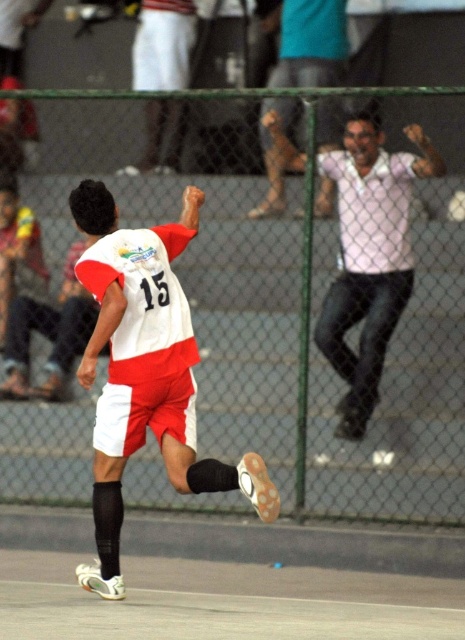
Question: Which object is positioned closest to the white matte soccer jersey at center?

Choices:
 (A) white shirt at upper center
 (B) white shirt at upper right

Answer: (B)

Question: Which object appears closest to the camera in this image?

Choices:
 (A) white shirt at upper right
 (B) white matte soccer jersey at center

Answer: (B)

Question: Does white matte soccer jersey at center have a lesser width compared to white shirt at upper right?

Choices:
 (A) no
 (B) yes

Answer: (B)

Question: Which of the following is the closest to the observer?

Choices:
 (A) white matte soccer jersey at center
 (B) white shirt at upper right
 (C) white shirt at upper center

Answer: (A)

Question: Is the position of white matte soccer jersey at center more distant than that of white shirt at upper right?

Choices:
 (A) yes
 (B) no

Answer: (B)

Question: Does white matte soccer jersey at center appear on the left side of white shirt at upper center?

Choices:
 (A) no
 (B) yes

Answer: (B)